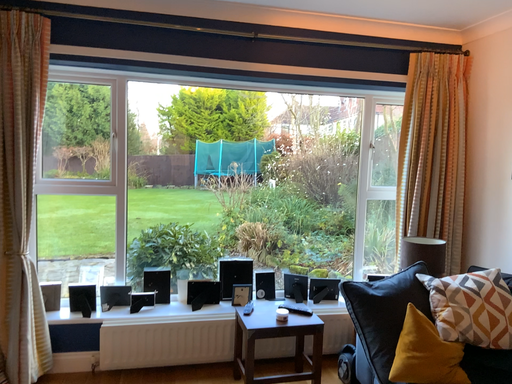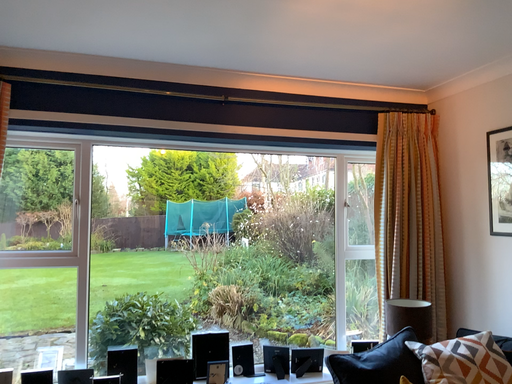
Question: How did the camera likely rotate when shooting the video?

Choices:
 (A) rotated upward
 (B) rotated downward

Answer: (A)